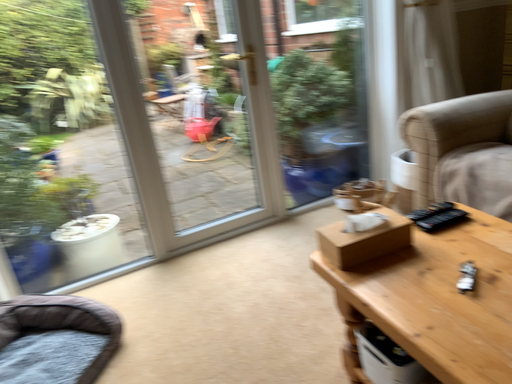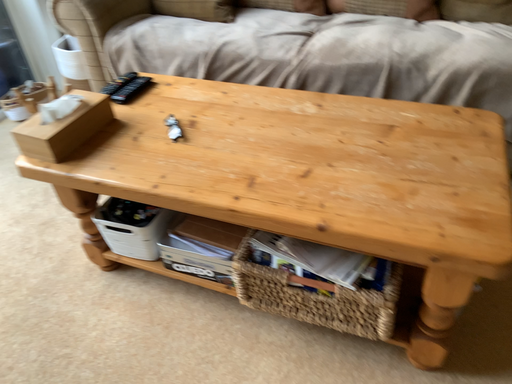
Question: Which way did the camera rotate in the video?

Choices:
 (A) rotated left
 (B) rotated right

Answer: (B)